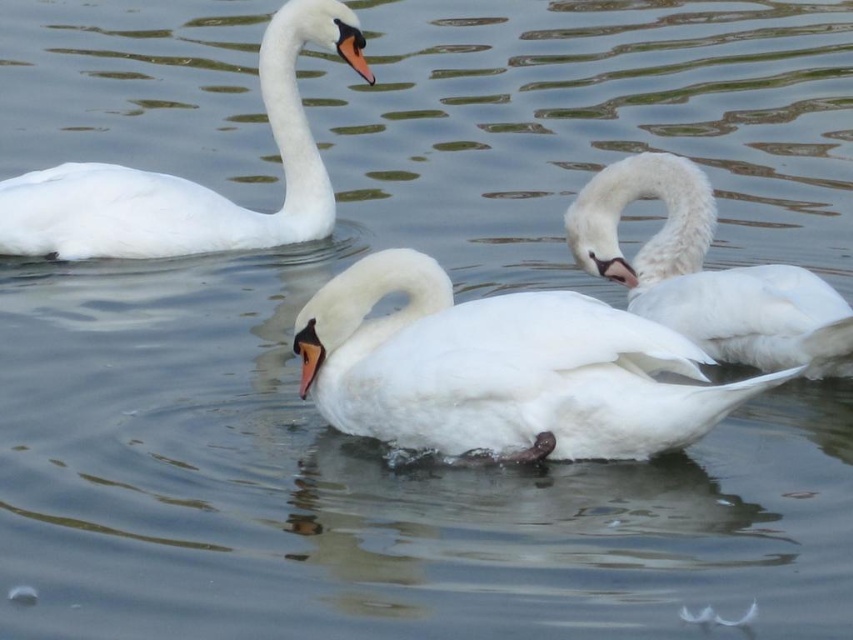
Question: Is white matte swan at center above white fluffy swan at center?

Choices:
 (A) no
 (B) yes

Answer: (A)

Question: Does white glossy swan at upper left appear under white fluffy swan at center?

Choices:
 (A) no
 (B) yes

Answer: (A)

Question: In this image, where is white matte swan at center located relative to white glossy swan at upper left?

Choices:
 (A) right
 (B) left

Answer: (A)

Question: Which object is the closest to the white fluffy swan at center?

Choices:
 (A) white matte swan at center
 (B) white glossy swan at upper left

Answer: (A)

Question: Which of the following is the closest to the observer?

Choices:
 (A) white glossy swan at upper left
 (B) white fluffy swan at center
 (C) white matte swan at center

Answer: (C)

Question: Considering the real-world distances, which object is farthest from the white glossy swan at upper left?

Choices:
 (A) white matte swan at center
 (B) white fluffy swan at center

Answer: (A)